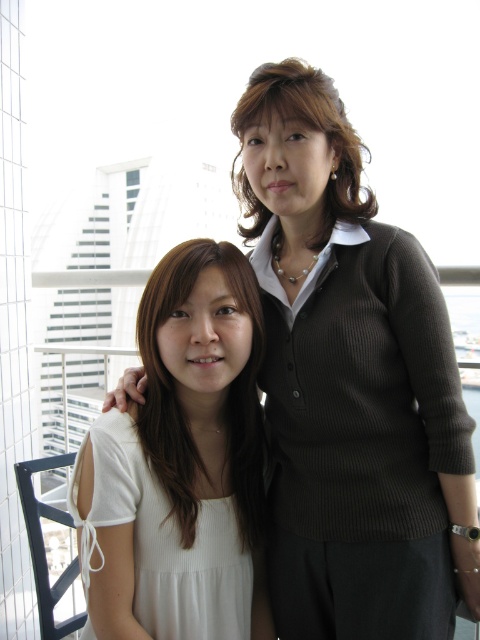
In the scene shown: How far apart are white ribbed dress at left and matte brown hair at center?

They are 3.95 feet apart.

Which of these two, white ribbed dress at left or matte brown hair at center, stands taller?

With more height is white ribbed dress at left.

Who is more forward, (182, 554) or (327, 100)?

Point (327, 100)

The width and height of the screenshot is (480, 640). In order to click on white ribbed dress at left in this screenshot , I will do 164,541.

Can you confirm if white matte shirt at center is positioned above matte brown hair at center?

Incorrect, white matte shirt at center is not positioned above matte brown hair at center.

The width and height of the screenshot is (480, 640). In order to click on white matte shirt at center in this screenshot , I will do `click(180, 406)`.

What are the coordinates of `white matte shirt at center` in the screenshot? It's located at (180, 406).

Which is more to the right, matte brown sweater at center or matte brown hair at center?

From the viewer's perspective, matte brown sweater at center appears more on the right side.

Is matte brown sweater at center in front of matte brown hair at center?

Yes, matte brown sweater at center is in front of matte brown hair at center.

Between point (279, 365) and point (279, 61), which one is positioned behind?

Positioned behind is point (279, 61).

Where is `matte brown sweater at center`? Image resolution: width=480 pixels, height=640 pixels. matte brown sweater at center is located at coordinates (350, 384).